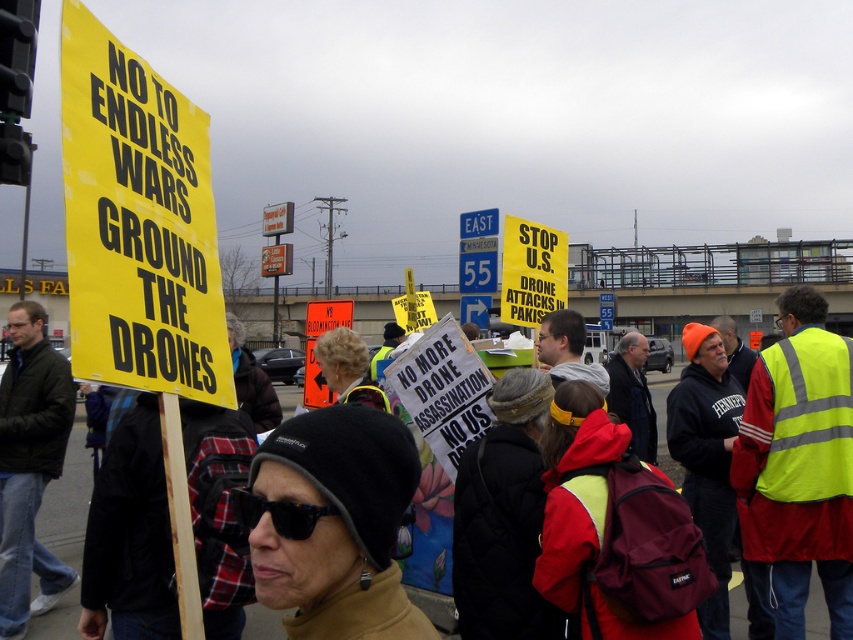
Can you confirm if yellow paper sign at center is positioned above black plastic sunglasses at center?

Yes, yellow paper sign at center is above black plastic sunglasses at center.

Measure the distance between point (532, 237) and camera.

The distance of point (532, 237) from camera is 19.94 feet.

Locate an element on the screen. The width and height of the screenshot is (853, 640). yellow paper sign at center is located at coordinates (531, 272).

Does reflective yellow safety vest at center have a greater width compared to yellow paper sign at center?

Indeed, reflective yellow safety vest at center has a greater width compared to yellow paper sign at center.

Does point (608, 579) come closer to viewer compared to point (503, 252)?

Yes, it is.

At what (x,y) coordinates should I click in order to perform the action: click on reflective yellow safety vest at center. Please return your answer as a coordinate pair (x, y). Looking at the image, I should click on (614, 531).

Does dark green jacket at left appear on the left side of black plastic sunglasses at center?

Indeed, dark green jacket at left is positioned on the left side of black plastic sunglasses at center.

Who is more distant from viewer, (0, 394) or (310, 522)?

Point (0, 394)

Is point (36, 506) behind point (241, 516)?

That is True.

You are a GUI agent. You are given a task and a screenshot of the screen. Output one action in this format:
    pyautogui.click(x=<x>, y=<y>)
    Task: Click on the dark green jacket at left
    This screenshot has width=853, height=640.
    Given the screenshot: What is the action you would take?
    pyautogui.click(x=30, y=465)